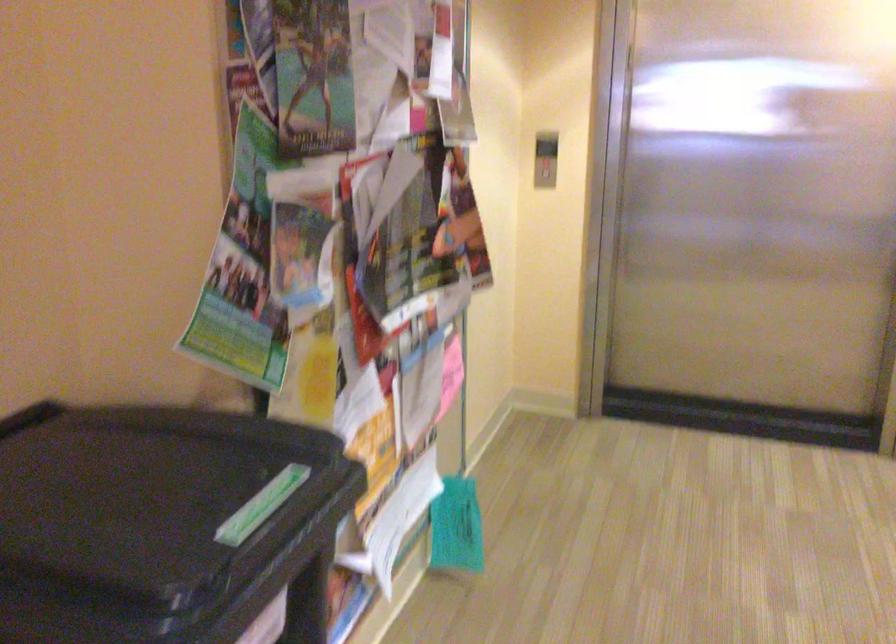
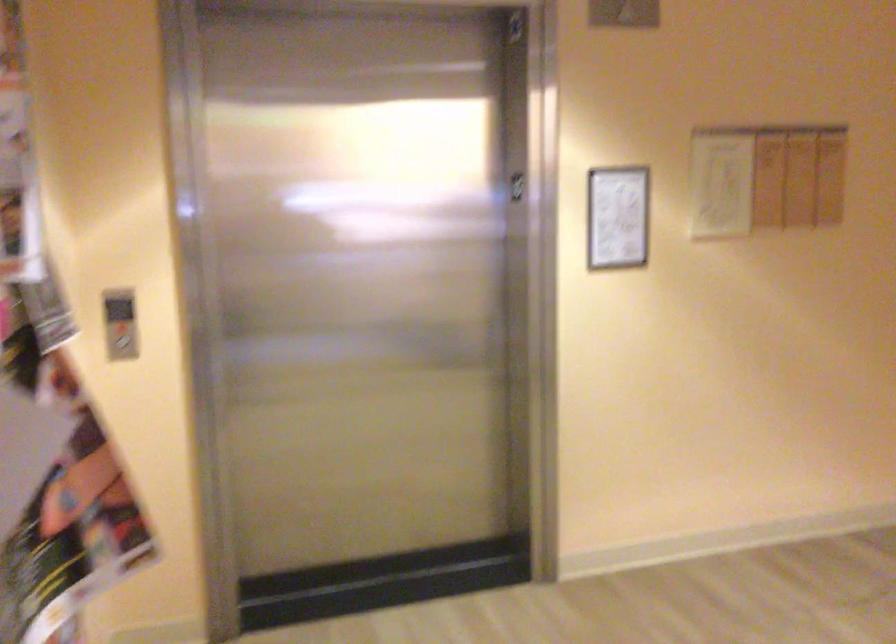
Question: How did the camera likely rotate?

Choices:
 (A) Left
 (B) Right
 (C) Up
 (D) Down

Answer: (B)